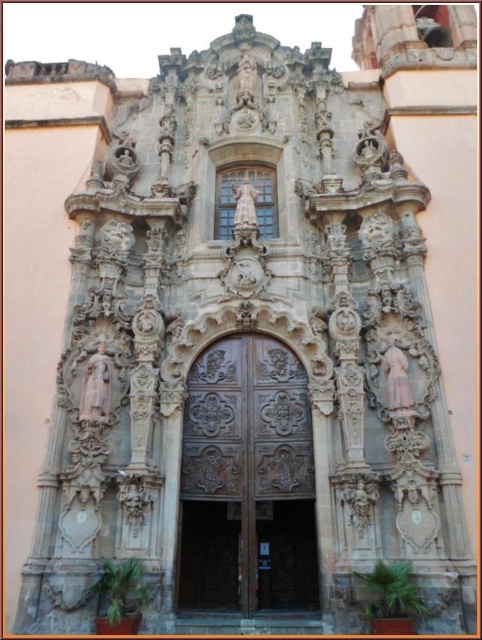
You are an architect assessing the symmetry of the historic building facade. The brown carved wood door at center and the white marble statue at center are key elements. Based on their widths, which one do you think is wider?

The brown carved wood door at center might be wider than white marble statue at center according to the description.

You are standing in front of the historic building and want to take a photo of the pink marble statue at upper left. Considering your camera has a maximum zoom range of 50 meters, will you be able to capture the statue clearly without moving closer?

The pink marble statue at upper left is 56.66 meters away from camera. Since the camera can only zoom up to 50 meters, you won not be able to capture the statue clearly without moving closer.